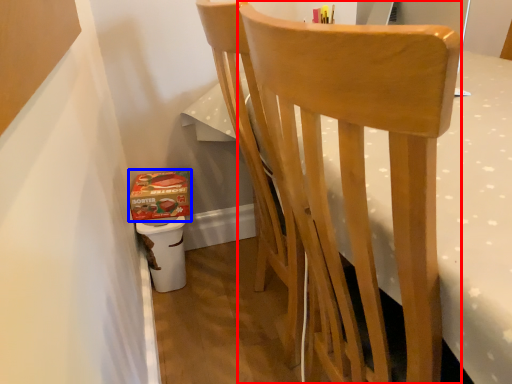
Question: Which object is closer to the camera taking this photo, chair (highlighted by a red box) or box (highlighted by a blue box)?

Choices:
 (A) chair
 (B) box

Answer: (A)